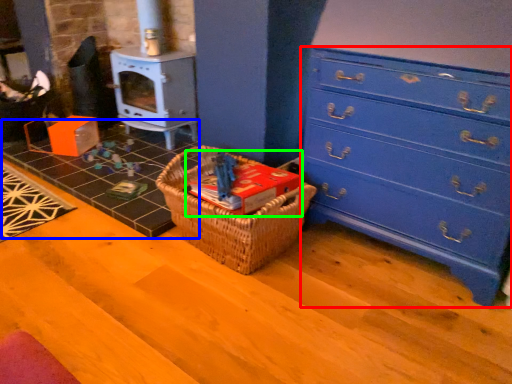
Question: Considering the real-world distances, which object is farthest from chest of drawers (highlighted by a red box)? tile (highlighted by a blue box) or book (highlighted by a green box)?

Choices:
 (A) tile
 (B) book

Answer: (A)